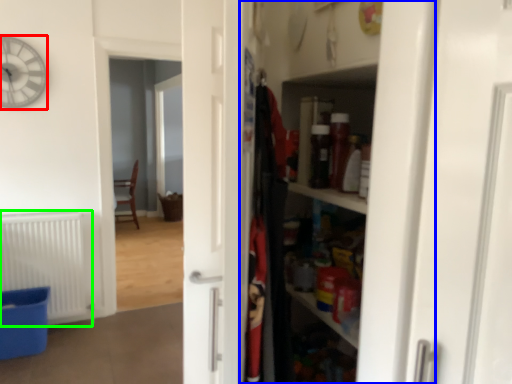
Question: Which object is the farthest from clock (highlighted by a red box)? Choose among these: dresser (highlighted by a blue box) or radiator (highlighted by a green box).

Choices:
 (A) dresser
 (B) radiator

Answer: (A)